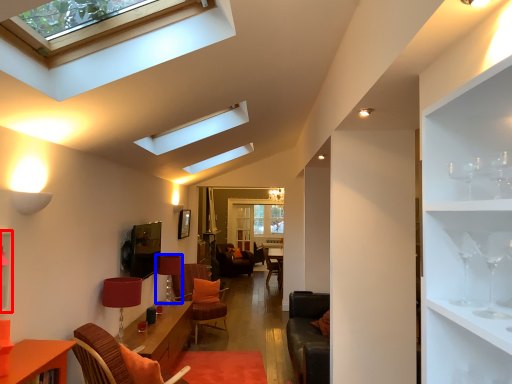
Question: Which object is further to the camera taking this photo, shelf (highlighted by a red box) or lamp (highlighted by a blue box)?

Choices:
 (A) shelf
 (B) lamp

Answer: (B)